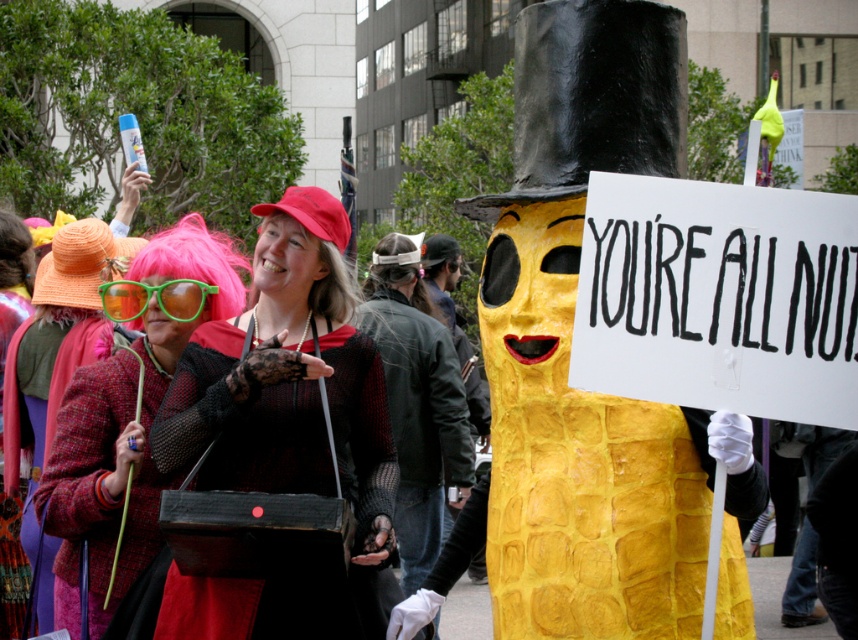
Does matte black purse at center have a smaller size compared to green plastic goggles at center?

Incorrect, matte black purse at center is not smaller in size than green plastic goggles at center.

Is point (196, 627) positioned before point (177, 284)?

Yes, point (196, 627) is closer to viewer.

Locate an element on the screen. The image size is (858, 640). matte black purse at center is located at coordinates (282, 420).

Is matte pink wig at upper left to the right of matte red coat at center from the viewer's perspective?

Yes, matte pink wig at upper left is to the right of matte red coat at center.

Who is positioned more to the right, matte pink wig at upper left or matte red coat at center?

Positioned to the right is matte pink wig at upper left.

What do you see at coordinates (130, 417) in the screenshot? This screenshot has width=858, height=640. I see `matte pink wig at upper left` at bounding box center [130, 417].

Find the location of a particular element. Image resolution: width=858 pixels, height=640 pixels. matte pink wig at upper left is located at coordinates (130, 417).

Is matte black purse at center taller than matte pink wig at upper left?

No.

The image size is (858, 640). Identify the location of matte black purse at center. (282, 420).